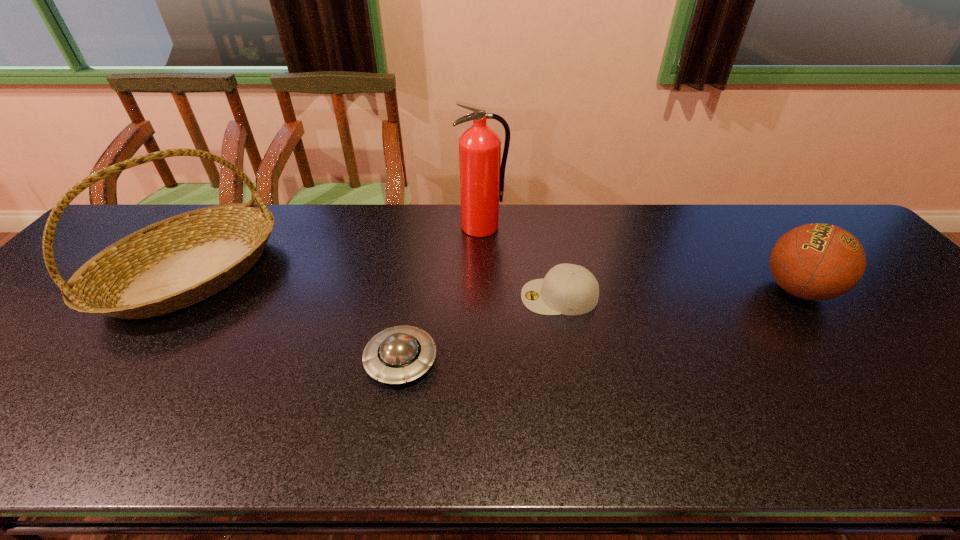
Where is `free space at the left edge of the desktop`? The image size is (960, 540). free space at the left edge of the desktop is located at coordinates (18, 369).

Where is `free location at the right edge of the desktop`? The height and width of the screenshot is (540, 960). free location at the right edge of the desktop is located at coordinates (863, 289).

Find the location of a particular element. The height and width of the screenshot is (540, 960). vacant region at the far right corner of the desktop is located at coordinates (801, 211).

Find the location of a particular element. The width and height of the screenshot is (960, 540). free spot between the rightmost object and the saucer is located at coordinates (599, 325).

This screenshot has width=960, height=540. In order to click on free space between the basket and the fire extinguisher in this screenshot , I will do `click(337, 250)`.

At what (x,y) coordinates should I click in order to perform the action: click on free area in between the cap and the fourth object from right to left. Please return your answer as a coordinate pair (x, y). Looking at the image, I should click on (480, 329).

Locate an element on the screen. free spot between the third object from right to left and the shortest object is located at coordinates (442, 294).

Locate an element on the screen. The height and width of the screenshot is (540, 960). free spot between the third object from right to left and the rightmost object is located at coordinates (639, 258).

This screenshot has width=960, height=540. Identify the location of empty space between the basket and the shortest object. (297, 317).

The width and height of the screenshot is (960, 540). I want to click on vacant area between the fire extinguisher and the shortest object, so click(442, 294).